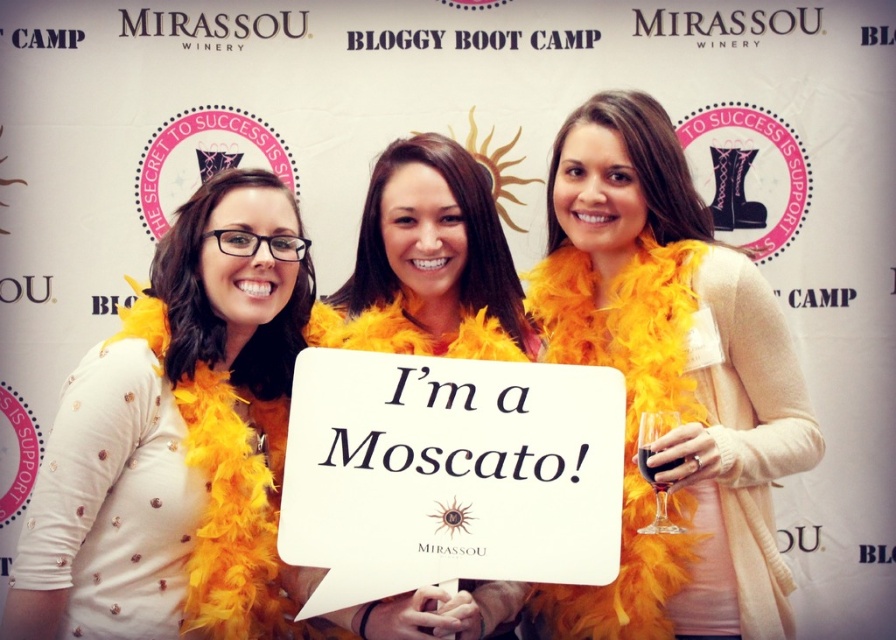
Question: Which object is closer to the camera taking this photo?

Choices:
 (A) feather boa at center
 (B) white sequined top at center
 (C) matte orange feather boa at center

Answer: (C)

Question: Based on their relative distances, which object is farther from the matte orange feather boa at center?

Choices:
 (A) white sequined top at center
 (B) feather boa at center

Answer: (A)

Question: Does matte orange feather boa at center have a greater width compared to white sequined top at center?

Choices:
 (A) yes
 (B) no

Answer: (A)

Question: Does white sequined top at center have a larger size compared to feather boa at center?

Choices:
 (A) yes
 (B) no

Answer: (A)

Question: Can you confirm if white sequined top at center is positioned below feather boa at center?

Choices:
 (A) yes
 (B) no

Answer: (A)

Question: Which of the following is the closest to the observer?

Choices:
 (A) (266, 456)
 (B) (608, 177)

Answer: (A)